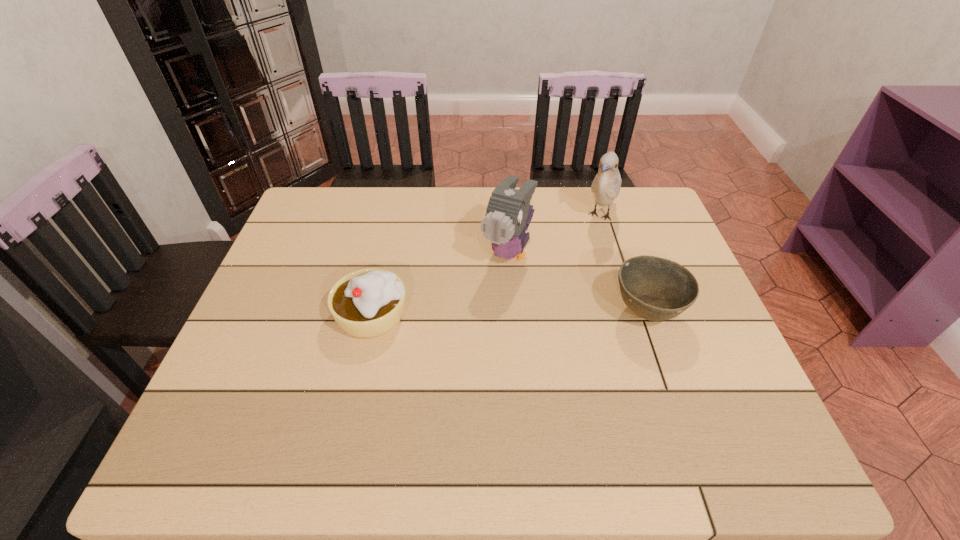
In order to click on vacant space at the far right corner of the desktop in this screenshot , I will do `click(625, 199)`.

You are a GUI agent. You are given a task and a screenshot of the screen. Output one action in this format:
    pyautogui.click(x=<x>, y=<y>)
    Task: Click on the free space between the third object from right to left and the bowl
    
    Given the screenshot: What is the action you would take?
    577,282

Locate an element on the screen. vacant area between the second object from left to right and the bowl is located at coordinates (577, 282).

Find the location of a particular element. The image size is (960, 540). vacant area that lies between the right bird and the whipped cream is located at coordinates (487, 266).

This screenshot has height=540, width=960. I want to click on free area in between the second object from left to right and the right bird, so click(x=555, y=234).

Where is `free spot between the left bird and the bowl`? This screenshot has height=540, width=960. free spot between the left bird and the bowl is located at coordinates (577, 282).

This screenshot has width=960, height=540. What are the coordinates of `free space between the third object from right to left and the right bird` in the screenshot? It's located at (555, 234).

Where is `vacant point located between the whipped cream and the right bird`? vacant point located between the whipped cream and the right bird is located at coordinates (487, 266).

At what (x,y) coordinates should I click in order to perform the action: click on free space between the right bird and the third object from right to left. Please return your answer as a coordinate pair (x, y). Looking at the image, I should click on (555, 234).

Choose which object is the second nearest neighbor to the left bird. Please provide its 2D coordinates. Your answer should be formatted as a tuple, i.e. [(x, y)], where the tuple contains the x and y coordinates of a point satisfying the conditions above.

[(656, 289)]